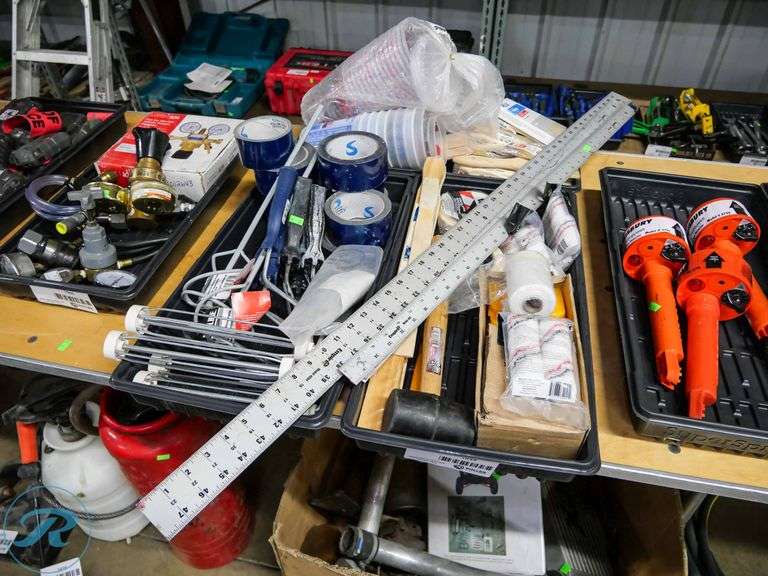
Where is `ladder`? ladder is located at coordinates (91, 68).